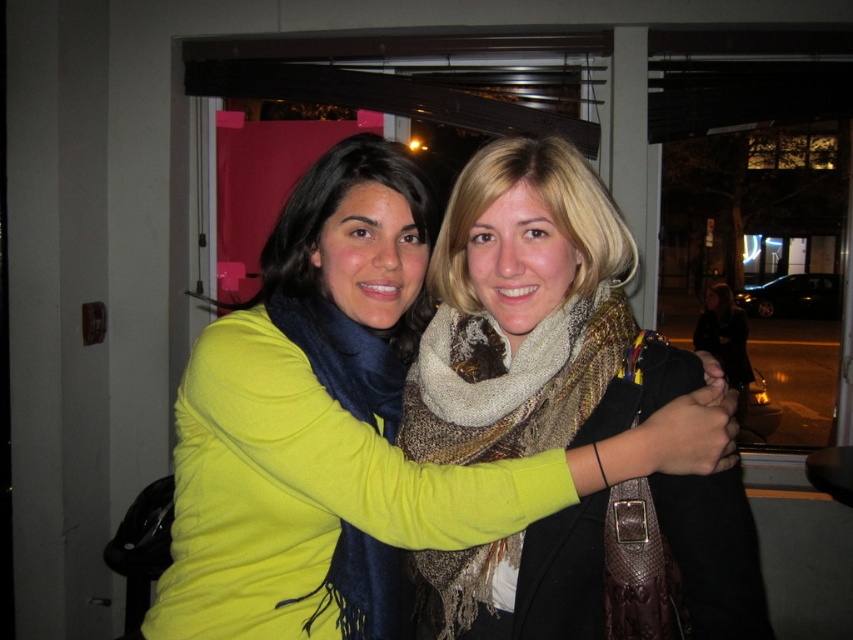
Question: Is matte yellow sweater at center wider than knitted multicolored scarf at center?

Choices:
 (A) yes
 (B) no

Answer: (A)

Question: Does matte yellow sweater at center come behind knitted multicolored scarf at center?

Choices:
 (A) no
 (B) yes

Answer: (A)

Question: Which point is farther from the camera taking this photo?

Choices:
 (A) (381, 554)
 (B) (412, 417)

Answer: (B)

Question: Can you confirm if matte yellow sweater at center is bigger than knitted multicolored scarf at center?

Choices:
 (A) yes
 (B) no

Answer: (A)

Question: Which point is farther from the camera taking this photo?

Choices:
 (A) (395, 461)
 (B) (457, 420)

Answer: (B)

Question: Among these points, which one is nearest to the camera?

Choices:
 (A) (573, 397)
 (B) (239, 372)

Answer: (B)